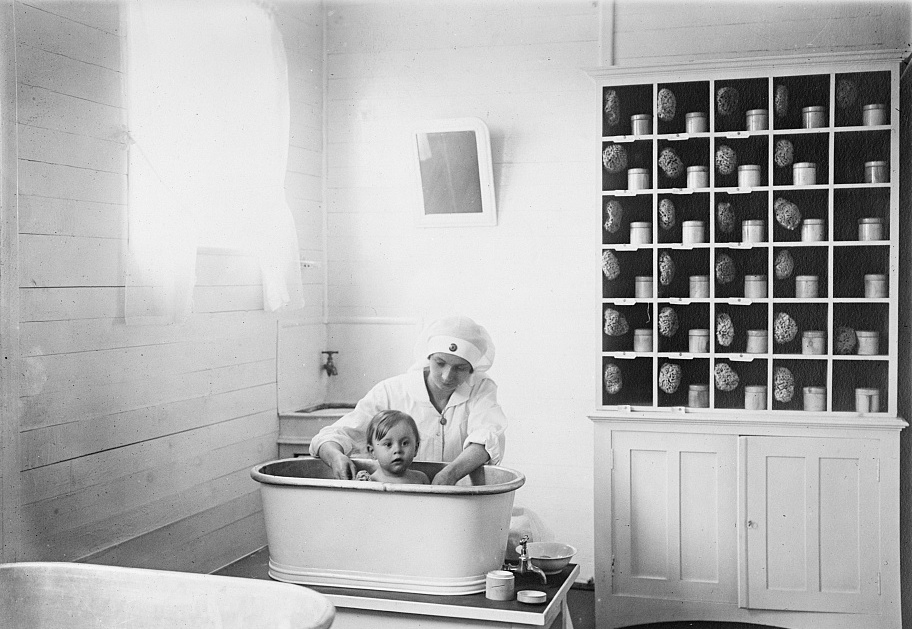
You are a GUI agent. You are given a task and a screenshot of the screen. Output one action in this format:
    pyautogui.click(x=<x>, y=<y>)
    Task: Click on the wall
    This screenshot has width=912, height=629.
    Given the screenshot: What is the action you would take?
    pyautogui.click(x=60, y=223), pyautogui.click(x=563, y=179), pyautogui.click(x=713, y=30)